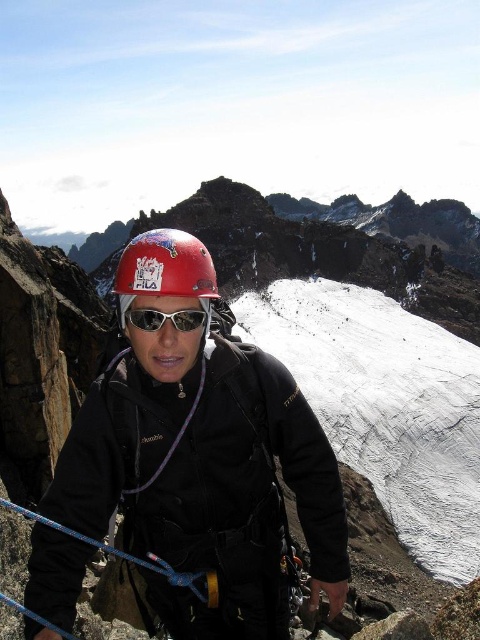
In the scene shown: You are a mountaineer preparing to adjust your gear. You have both the matte black helmet at center and the white reflective lens goggles at center. Which item do you need to handle with more care due to its size?

The matte black helmet at center is bigger than the white reflective lens goggles at center, so you should handle the matte black helmet at center with more care due to its size.

You are a mountaineer trying to locate your gear. You see a point at coordinates (x=202, y=456). What object is this point located on?

The point at coordinates (x=202, y=456) is located on the matte black helmet at center.

You are a mountaineer assessing the safety of your climbing route. You notice two points on your climbing path marked as point 1 at coordinates point (277, 490) and point 2 at coordinates point (37, 520). Which point is closer to your current position as you look at the climbing route?

Point 2 at coordinates point (37, 520) is closer to your current position because it is closer to the camera than point 1 at coordinates point (277, 490), which is further away.